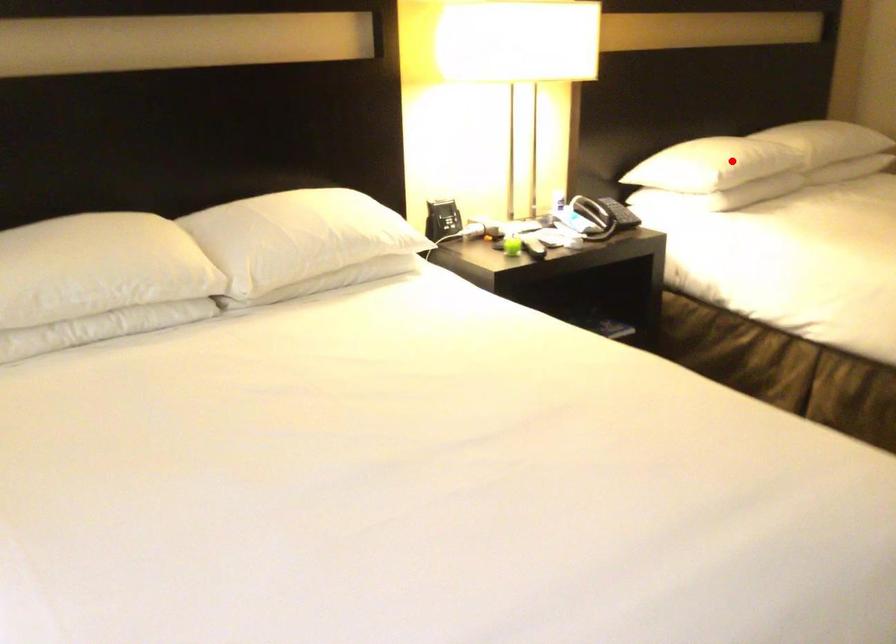
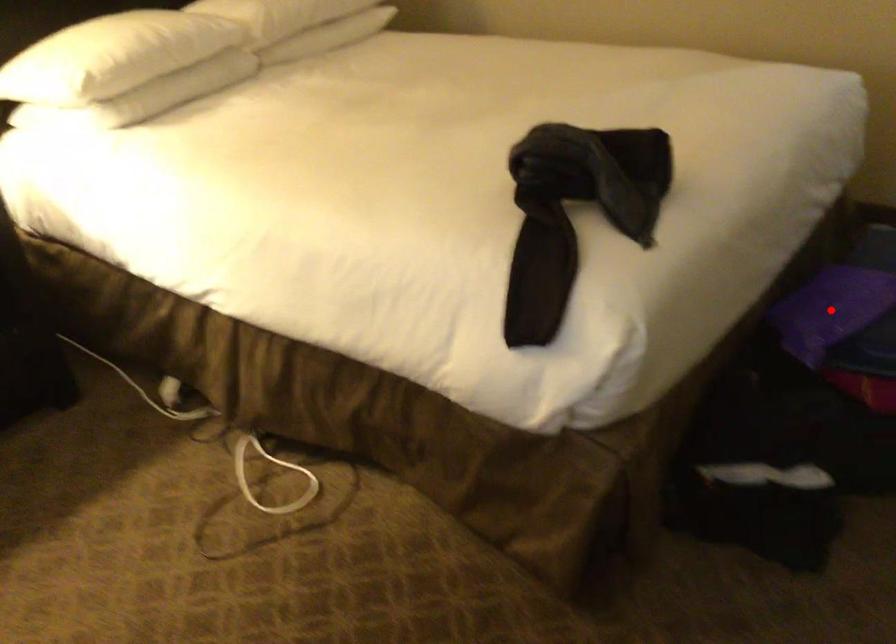
I am providing you with two images of the same scene from different viewpoints. A red point is marked on the first image and another point is marked on the second image. Is the marked point in image1 the same physical position as the marked point in image2?

No